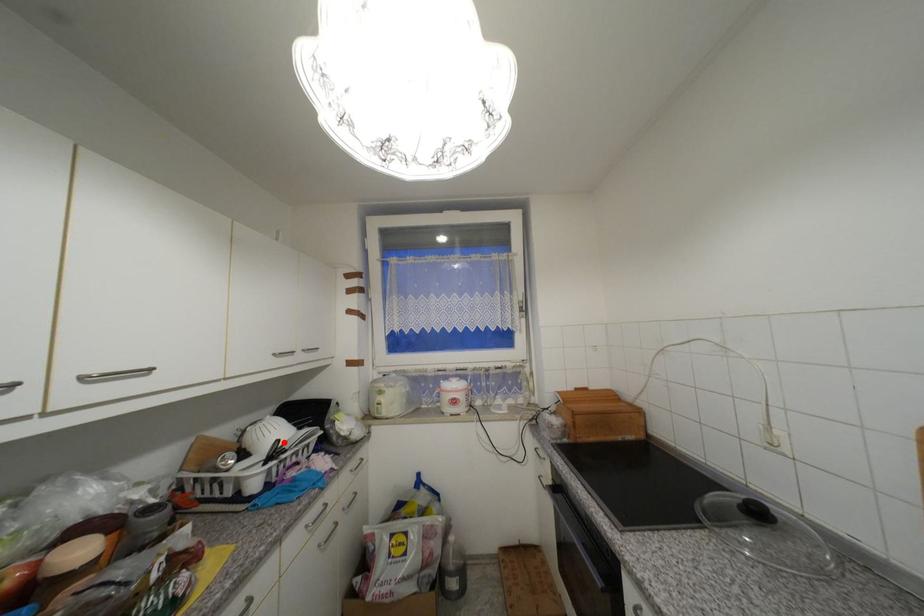
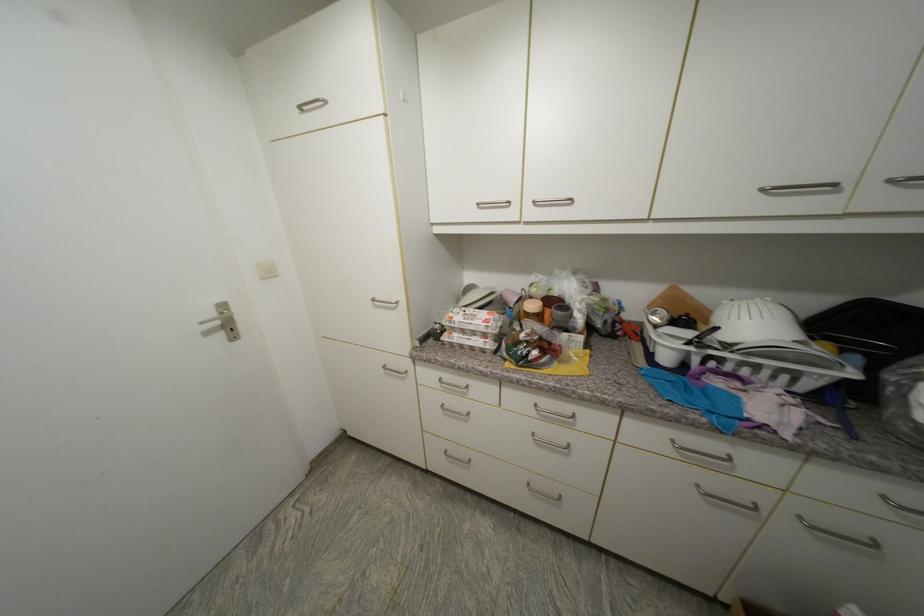
The point at the highlighted location is marked in the first image. Where is the corresponding point in the second image?

(723, 330)